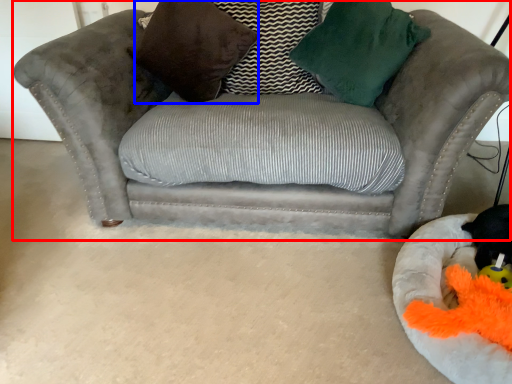
Question: Among these objects, which one is nearest to the camera, studio couch (highlighted by a red box) or pillow (highlighted by a blue box)?

Choices:
 (A) studio couch
 (B) pillow

Answer: (A)